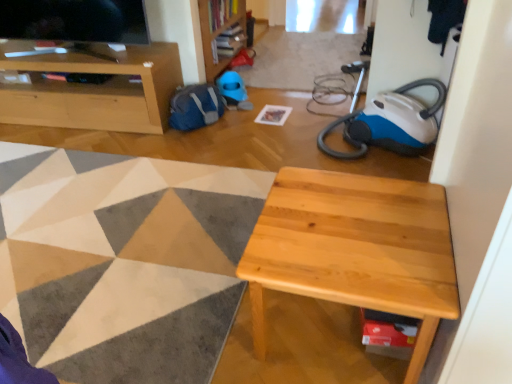
Where is `vacant space underneath natural wood table at center (from a real-world perspective)`? vacant space underneath natural wood table at center (from a real-world perspective) is located at coordinates (317, 331).